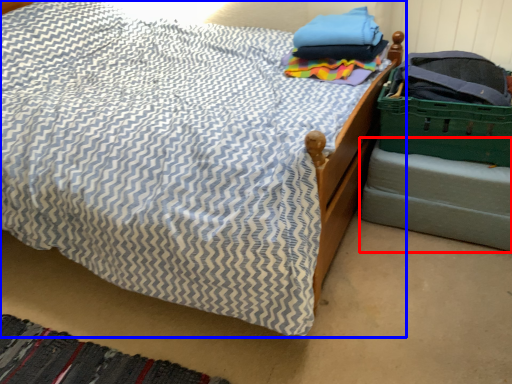
Question: Which point is further to the camera, bed frame (highlighted by a red box) or bed (highlighted by a blue box)?

Choices:
 (A) bed frame
 (B) bed

Answer: (A)